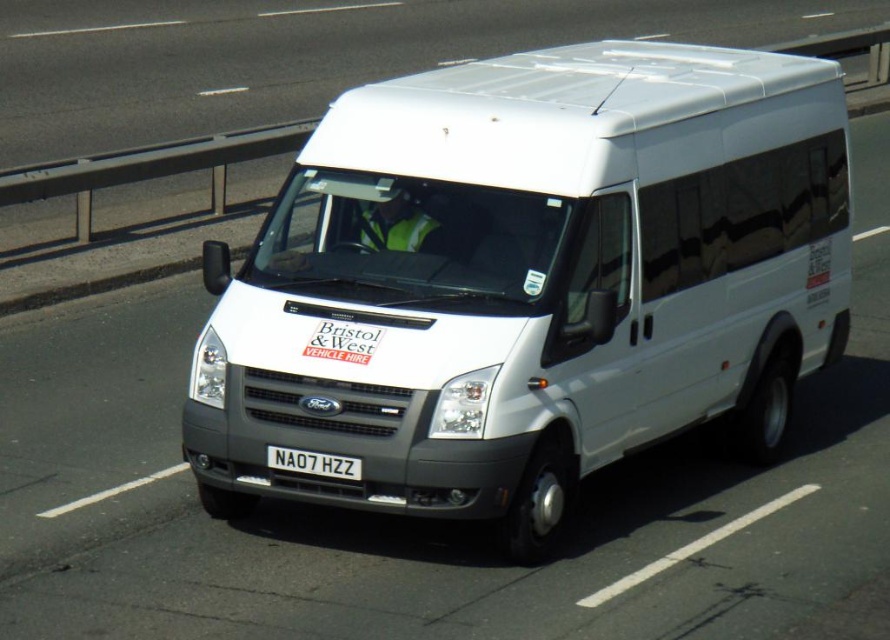
Where is the white matte van at center located in the image?

The white matte van at center is located at point (530, 280) in the image.

You are a delivery driver who needs to enter a low tunnel. The tunnel has a height restriction of 2 meters. You are looking at the white matte van at center and the white plastic license plate at center in the image. Can you estimate whether the van will fit through the tunnel based on their sizes?

The white matte van at center is much taller than the white plastic license plate at center. Since the license plate is typically mounted at a standard height on the vehicle, this comparison suggests the van exceeds the 2 meter height restriction, so it might not fit through the tunnel.